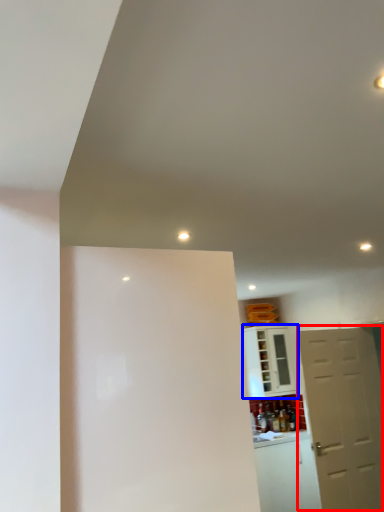
Question: Among these objects, which one is farthest to the camera, door (highlighted by a red box) or cabinetry (highlighted by a blue box)?

Choices:
 (A) door
 (B) cabinetry

Answer: (B)